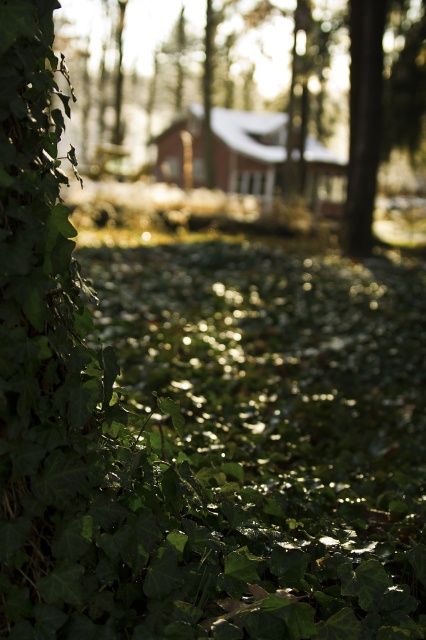
Question: Among these objects, which one is farthest from the camera?

Choices:
 (A) green leafy tree at left
 (B) wooden cabin at center

Answer: (B)

Question: Is green leafy tree at left further to camera compared to wooden cabin at center?

Choices:
 (A) no
 (B) yes

Answer: (A)

Question: Is green leafy tree at left to the right of wooden cabin at center from the viewer's perspective?

Choices:
 (A) no
 (B) yes

Answer: (A)

Question: Considering the relative positions of green leafy tree at left and wooden cabin at center in the image provided, where is green leafy tree at left located with respect to wooden cabin at center?

Choices:
 (A) right
 (B) left

Answer: (B)

Question: Which object appears closest to the camera in this image?

Choices:
 (A) green leafy tree at left
 (B) wooden cabin at center

Answer: (A)